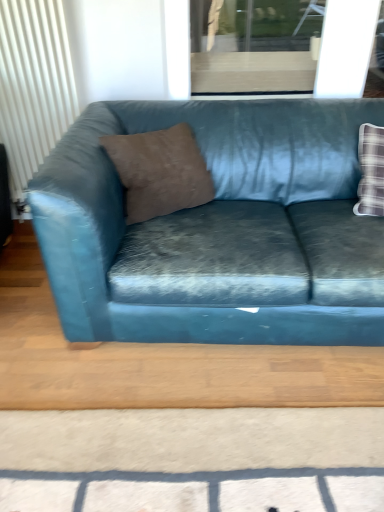
Question: From a real-world perspective, is transparent glass window at upper center positioned over white textured radiator at left based on gravity?

Choices:
 (A) yes
 (B) no

Answer: (A)

Question: Is transparent glass window at upper center facing towards white textured radiator at left?

Choices:
 (A) no
 (B) yes

Answer: (A)

Question: Considering the relative sizes of transparent glass window at upper center and white textured radiator at left in the image provided, is transparent glass window at upper center taller than white textured radiator at left?

Choices:
 (A) yes
 (B) no

Answer: (B)

Question: From a real-world perspective, is transparent glass window at upper center under white textured radiator at left?

Choices:
 (A) no
 (B) yes

Answer: (A)

Question: Is there a large distance between transparent glass window at upper center and white textured radiator at left?

Choices:
 (A) yes
 (B) no

Answer: (B)

Question: Is transparent glass window at upper center turned away from white textured radiator at left?

Choices:
 (A) no
 (B) yes

Answer: (A)

Question: From the image's perspective, is transparent glass window at upper center beneath brown suede pillow at center?

Choices:
 (A) no
 (B) yes

Answer: (A)

Question: From a real-world perspective, is transparent glass window at upper center over brown suede pillow at center?

Choices:
 (A) yes
 (B) no

Answer: (A)

Question: Is transparent glass window at upper center not close to brown suede pillow at center?

Choices:
 (A) no
 (B) yes

Answer: (A)

Question: Considering the relative positions of transparent glass window at upper center and brown suede pillow at center in the image provided, is transparent glass window at upper center to the right of brown suede pillow at center from the viewer's perspective?

Choices:
 (A) no
 (B) yes

Answer: (B)

Question: Is transparent glass window at upper center located outside brown suede pillow at center?

Choices:
 (A) yes
 (B) no

Answer: (A)

Question: From a real-world perspective, does transparent glass window at upper center sit lower than brown suede pillow at center?

Choices:
 (A) yes
 (B) no

Answer: (B)

Question: Does teal velvet couch at center appear on the left side of white textured radiator at left?

Choices:
 (A) no
 (B) yes

Answer: (A)